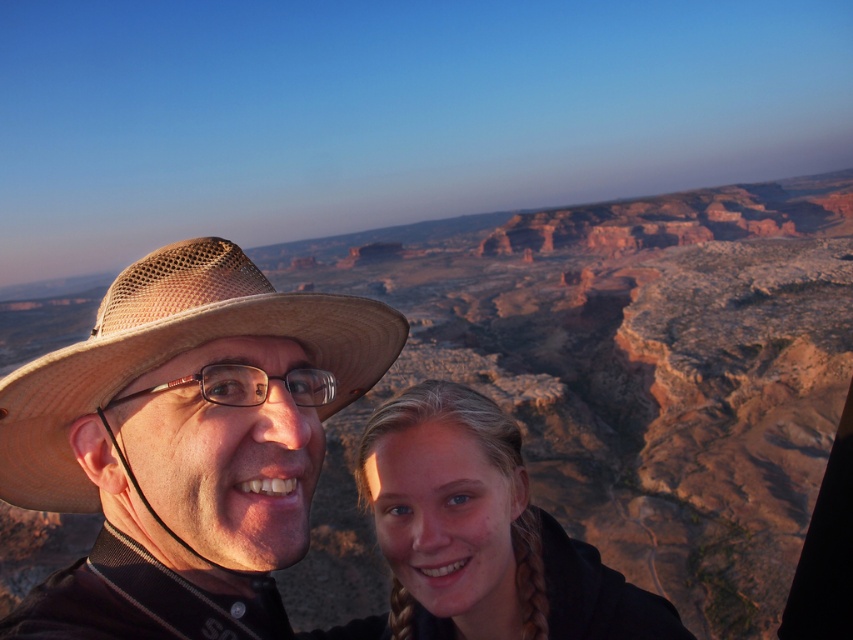
Question: Can you confirm if matte straw hat at left is smaller than blonde hair at lower center?

Choices:
 (A) yes
 (B) no

Answer: (A)

Question: Which point is farther to the camera?

Choices:
 (A) tan mesh cowboy hat at left
 (B) blonde hair at lower center
 (C) matte straw hat at left

Answer: (B)

Question: Among these objects, which one is nearest to the camera?

Choices:
 (A) blonde hair at lower center
 (B) clear plastic glasses at center
 (C) tan mesh cowboy hat at left
 (D) matte straw hat at left

Answer: (D)

Question: Among these points, which one is farthest from the camera?

Choices:
 (A) (294, 396)
 (B) (36, 496)
 (C) (421, 557)
 (D) (210, 339)

Answer: (C)

Question: Is matte straw hat at left above tan mesh cowboy hat at left?

Choices:
 (A) yes
 (B) no

Answer: (B)

Question: Does tan mesh cowboy hat at left have a larger size compared to clear plastic glasses at center?

Choices:
 (A) yes
 (B) no

Answer: (A)